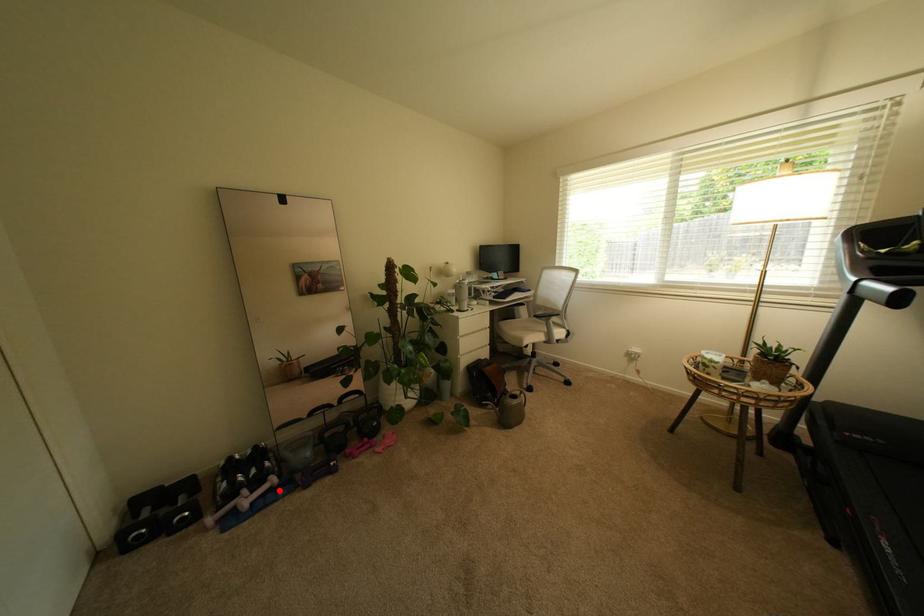
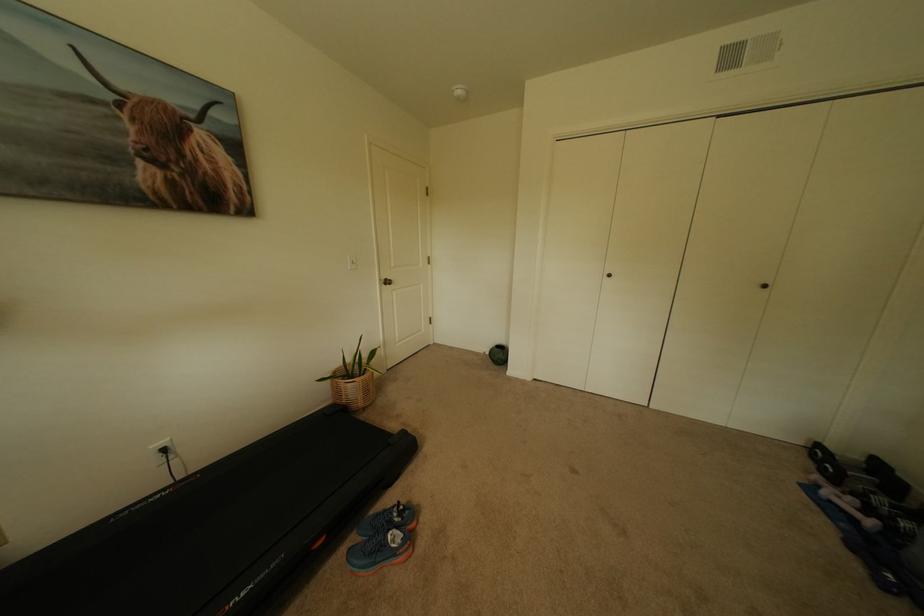
In the second image, find the point that corresponds to the highlighted location in the first image.

(862, 521)